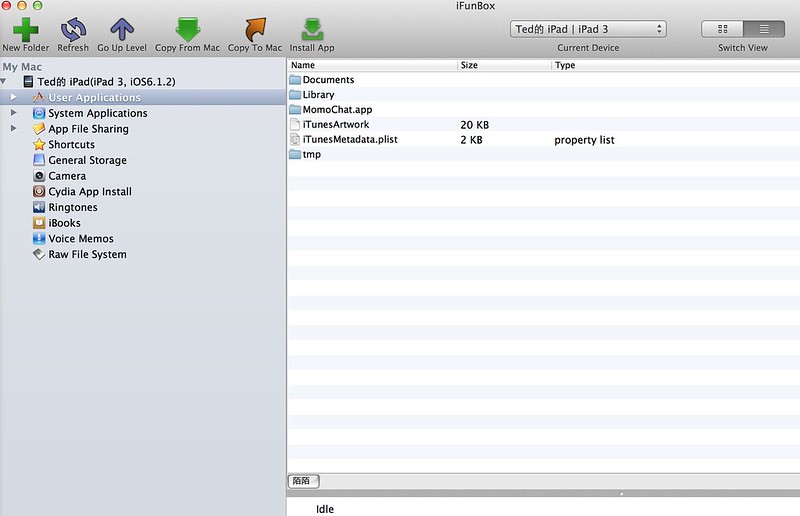
Locate an element on the screen. This screenshot has width=800, height=516. folders is located at coordinates (336, 79), (326, 94), (337, 106), (318, 155).